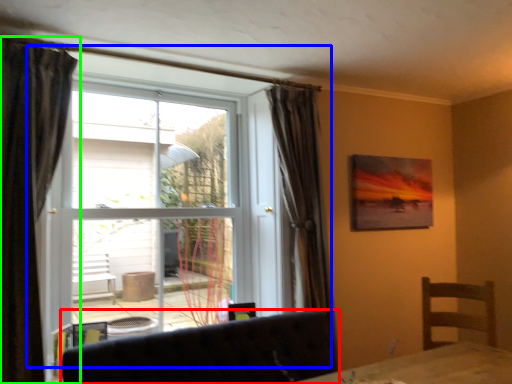
Question: Based on their relative distances, which object is nearer to furniture (highlighted by a red box)? Choose from window (highlighted by a blue box) and curtain (highlighted by a green box).

Choices:
 (A) window
 (B) curtain

Answer: (B)